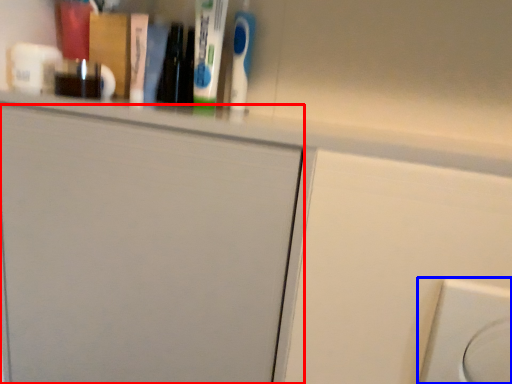
Question: Which of the following is the farthest to the observer, door (highlighted by a red box) or electric outlet (highlighted by a blue box)?

Choices:
 (A) door
 (B) electric outlet

Answer: (A)